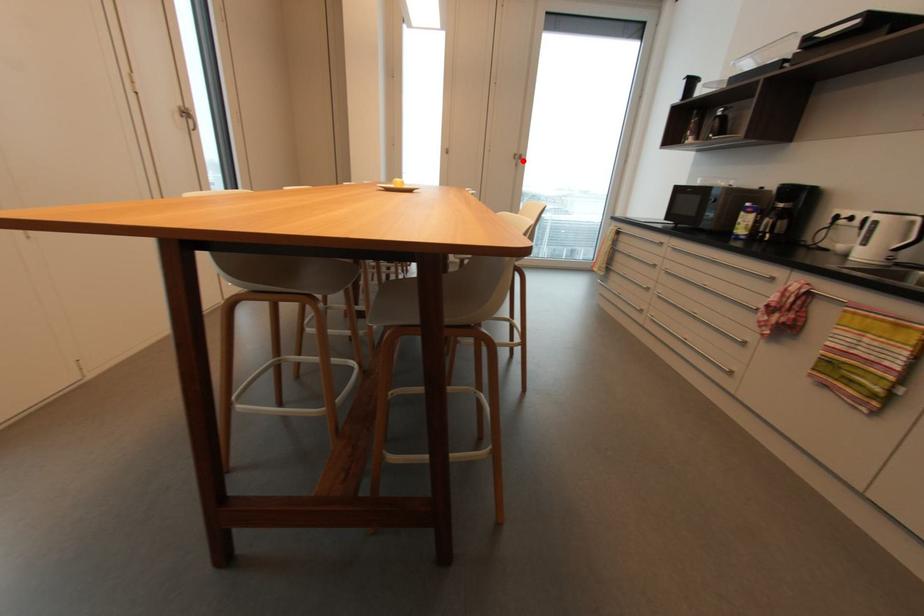
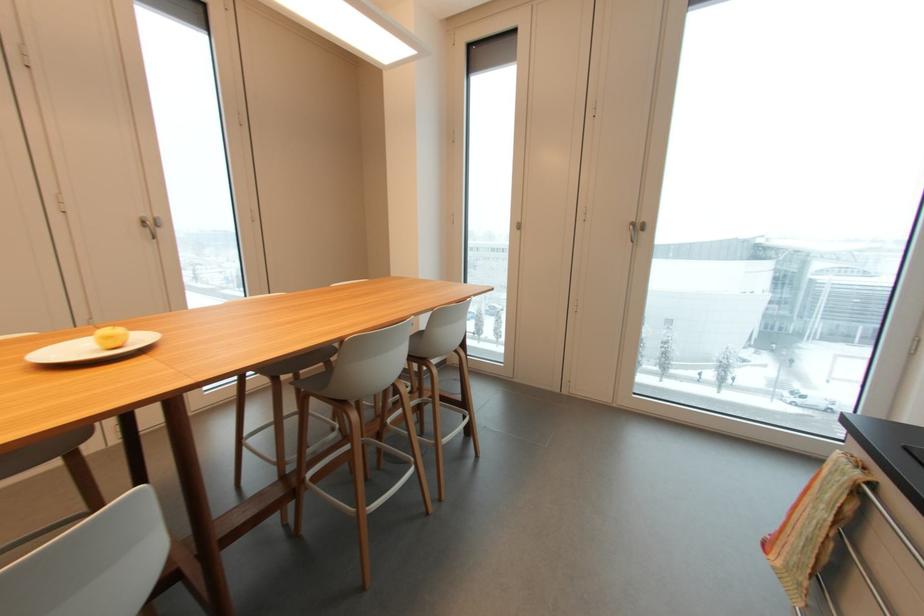
Find the pixel in the second image that matches the highlighted location in the first image.

(643, 233)